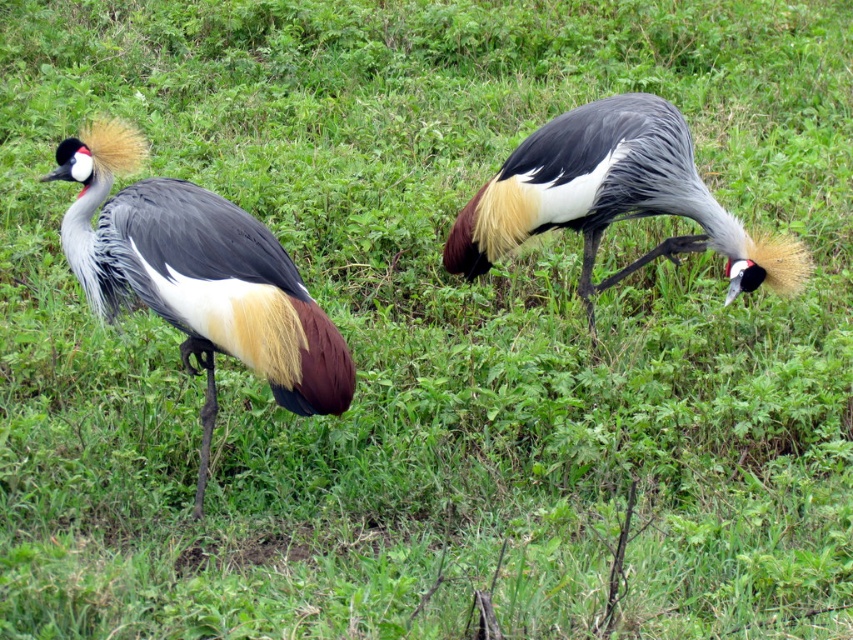
Question: Is the position of matte gray and white bird at left less distant than that of matte gray crane at center?

Choices:
 (A) yes
 (B) no

Answer: (A)

Question: Is matte gray and white bird at left positioned before matte gray crane at center?

Choices:
 (A) no
 (B) yes

Answer: (B)

Question: Which object is closer to the camera taking this photo?

Choices:
 (A) matte gray crane at center
 (B) matte gray and white bird at left

Answer: (B)

Question: Does matte gray and white bird at left come in front of matte gray crane at center?

Choices:
 (A) no
 (B) yes

Answer: (B)

Question: Which point is closer to the camera?

Choices:
 (A) (601, 200)
 (B) (86, 273)

Answer: (B)